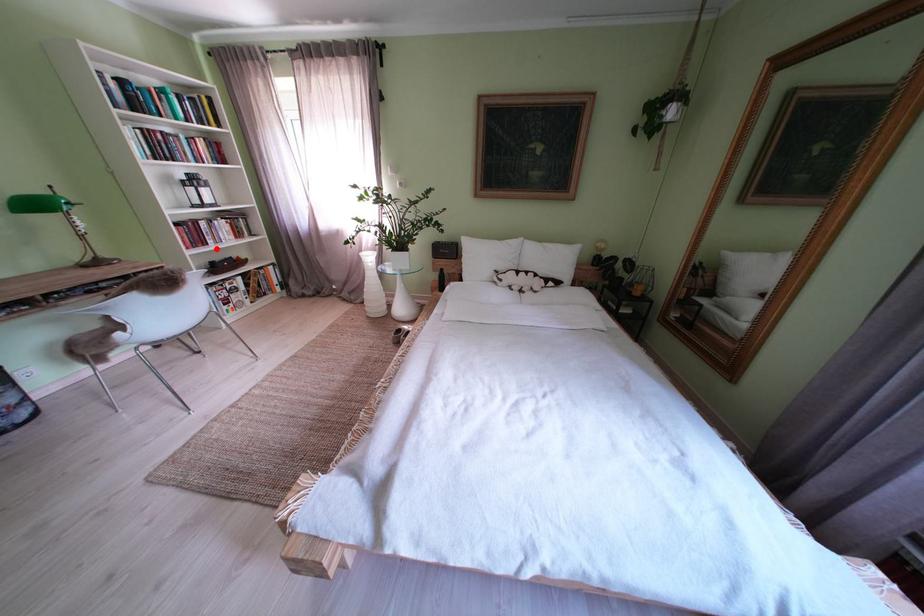
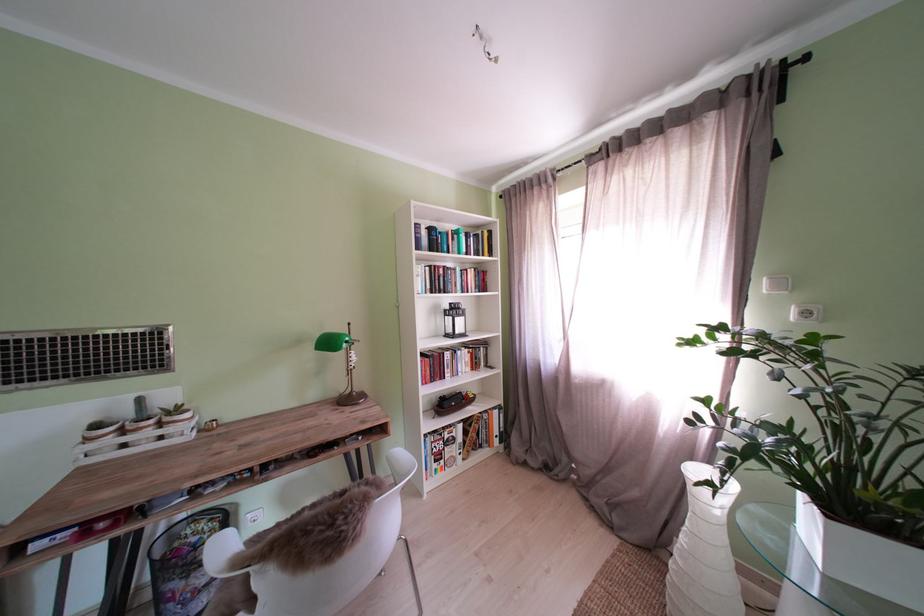
Question: I am providing you with two images of the same scene from different viewpoints. In image1, a red point is highlighted. Considering the same 3D point in image2, which of the following is correct?

Choices:
 (A) It is closer
 (B) It is farther

Answer: (B)